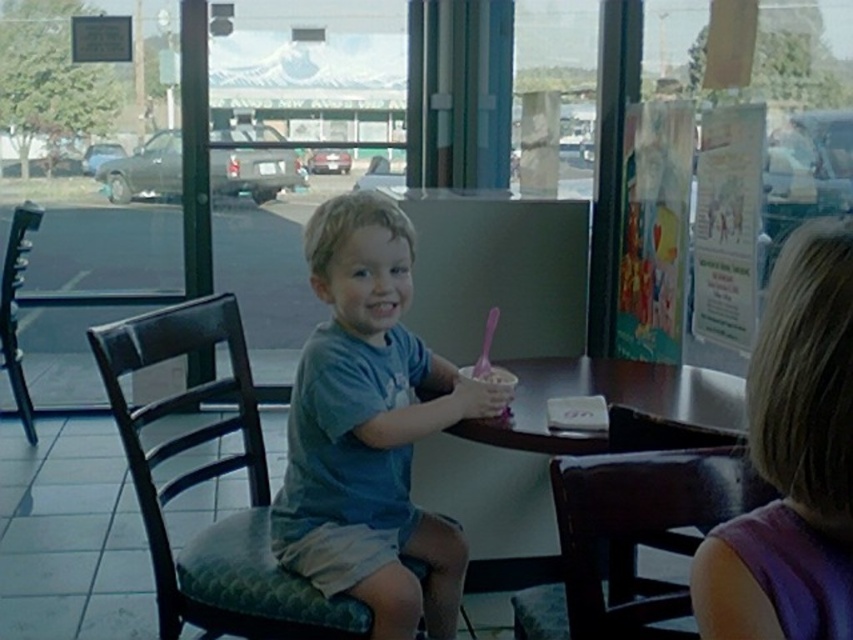
Does blue cotton shirt at center have a greater height compared to black leather chair at left?

No.

This screenshot has height=640, width=853. Identify the location of blue cotton shirt at center. click(369, 428).

Between wooden table at center and black leather chair at left, which one is positioned lower?

wooden table at center is below.

Between point (436, 440) and point (27, 209), which one is positioned in front?

Point (436, 440)

I want to click on wooden table at center, so click(550, 454).

Can you confirm if light brown hair at right is positioned below black leather chair at left?

Correct, light brown hair at right is located below black leather chair at left.

Is the position of light brown hair at right more distant than that of black leather chair at left?

That is False.

Between point (813, 540) and point (7, 344), which one is positioned in front?

Point (813, 540) is more forward.

This screenshot has height=640, width=853. Identify the location of light brown hair at right. (792, 460).